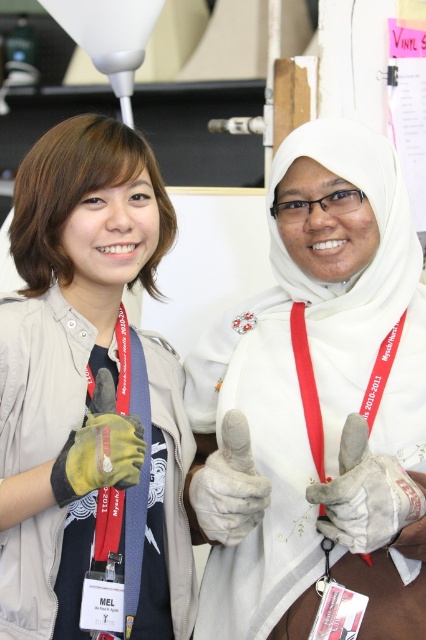
You are a fashion designer observing two items in the image. The matte gray jacket at center and the red fabric lanyard at center are both part of the outfit. Can you determine if there is enough space between them to comfortably place a small accessory, like a pendant necklace, between them?

The matte gray jacket at center and the red fabric lanyard at center are 14.34 inches apart from each other. Since 14.34 inches is a significant distance, there is enough space to comfortably place a small pendant necklace between them.